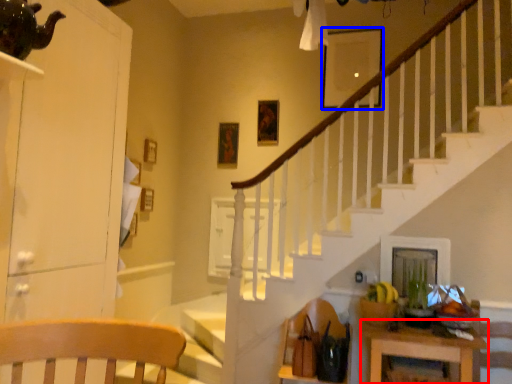
Question: Among these objects, which one is farthest to the camera, table (highlighted by a red box) or picture frame (highlighted by a blue box)?

Choices:
 (A) table
 (B) picture frame

Answer: (B)